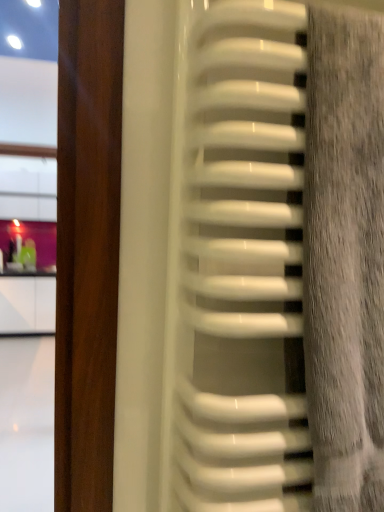
Question: Should I look upward or downward to see white glossy radiator at center?

Choices:
 (A) up
 (B) down

Answer: (B)